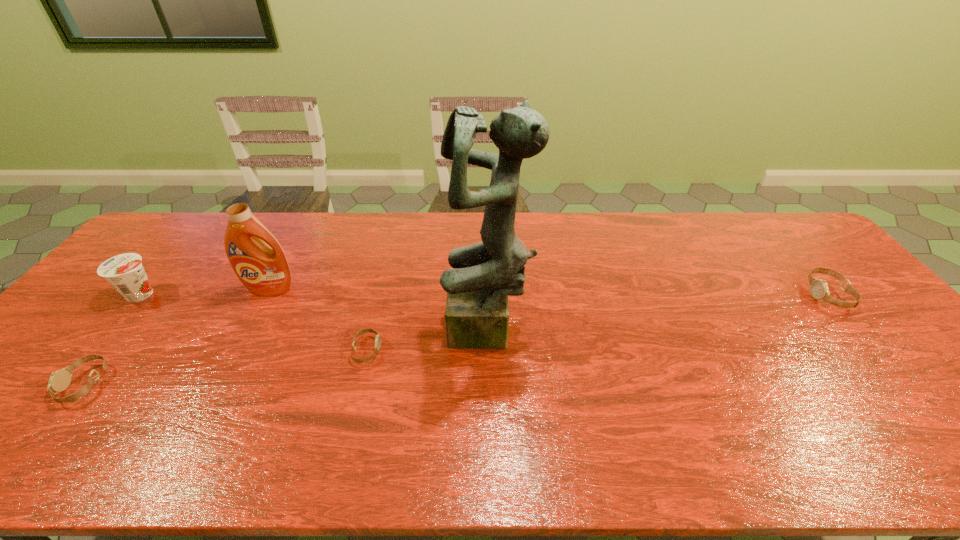
Where is `free region at the right edge`? The image size is (960, 540). free region at the right edge is located at coordinates (847, 333).

Identify the location of vacant area at the far right corner. The height and width of the screenshot is (540, 960). pyautogui.click(x=774, y=244).

In the image, there is a desktop. Where is `free space at the near right corner`? This screenshot has width=960, height=540. free space at the near right corner is located at coordinates (958, 403).

You are a GUI agent. You are given a task and a screenshot of the screen. Output one action in this format:
    pyautogui.click(x=<x>, y=<y>)
    Task: Click on the empty space between the detergent and the second watch from left to right
    This screenshot has height=540, width=960.
    Given the screenshot: What is the action you would take?
    pyautogui.click(x=319, y=320)

Image resolution: width=960 pixels, height=540 pixels. Find the location of `vacant area between the yogurt and the second watch from left to right`. vacant area between the yogurt and the second watch from left to right is located at coordinates (254, 322).

What are the coordinates of `free space between the fifth shortest object and the fourth object from left to right` in the screenshot? It's located at (319, 320).

Find the location of a particular element. This screenshot has height=540, width=960. free spot between the shortest watch and the leftmost watch is located at coordinates (226, 367).

This screenshot has width=960, height=540. I want to click on free space between the leftmost watch and the second tallest object, so click(x=178, y=336).

This screenshot has height=540, width=960. I want to click on vacant space in between the tallest object and the shortest object, so click(427, 341).

This screenshot has height=540, width=960. Identify the location of vacant space that's between the farthest watch and the sculpture. (658, 314).